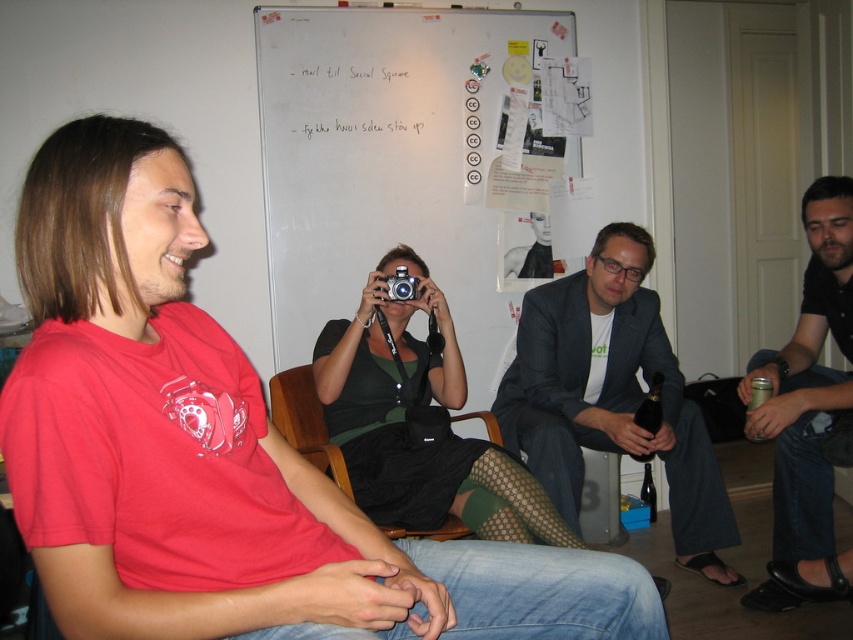
Does matte black camera at center have a greater width compared to black leather shoes at lower right?

Indeed, matte black camera at center has a greater width compared to black leather shoes at lower right.

Does matte black camera at center come in front of black leather shoes at lower right?

Yes.

Where is `matte black camera at center`? matte black camera at center is located at coordinates (218, 452).

Find the location of a particular element. Image resolution: width=853 pixels, height=640 pixels. matte black camera at center is located at coordinates (x=218, y=452).

Which is above, matte black camera at center or dark gray suit at center?

Positioned higher is matte black camera at center.

Does point (485, 576) come behind point (563, 362)?

That is False.

This screenshot has width=853, height=640. Find the location of `matte black camera at center`. matte black camera at center is located at coordinates (218, 452).

Identify the location of matte black camera at center. (218, 452).

Looking at this image, measure the distance from dark gray suit at center to wooden armchair at center.

The distance of dark gray suit at center from wooden armchair at center is 27.16 inches.

Can you confirm if dark gray suit at center is positioned above wooden armchair at center?

Yes.

Who is more forward, (554,307) or (428,536)?

Positioned in front is point (428,536).

I want to click on dark gray suit at center, so click(611, 396).